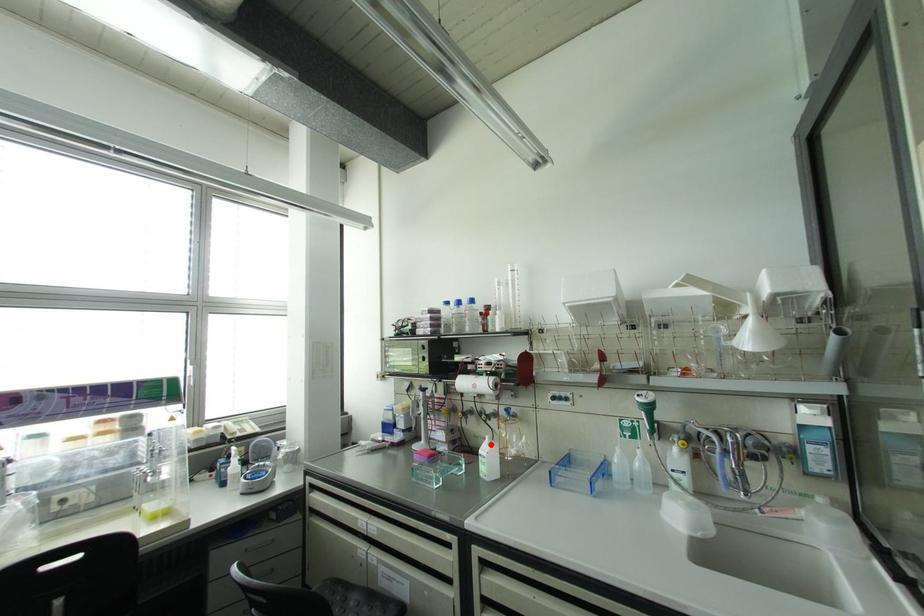
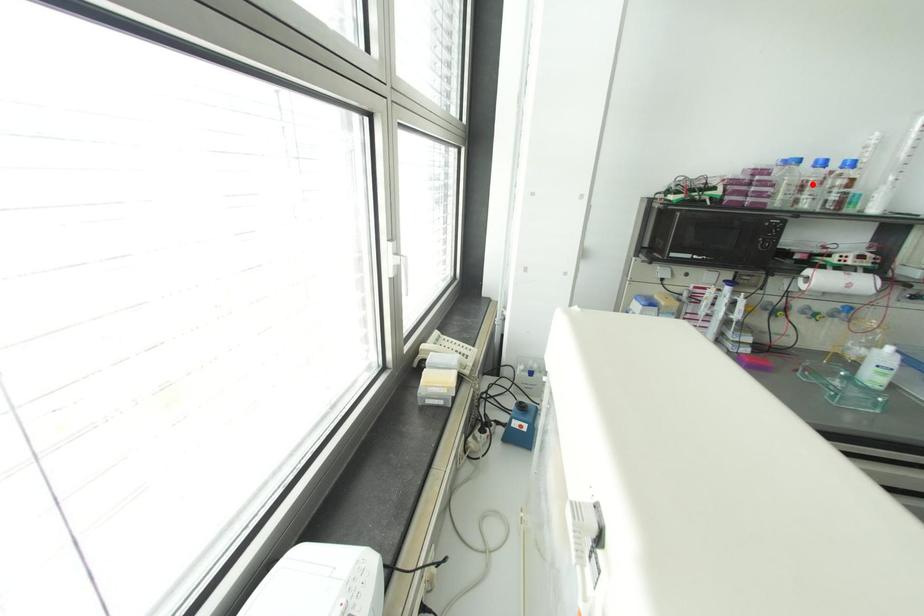
I am providing you with two images of the same scene from different viewpoints. A red point is marked on the first image and another point is marked on the second image. Does the point marked in image1 correspond to the same location as the one in image2?

No